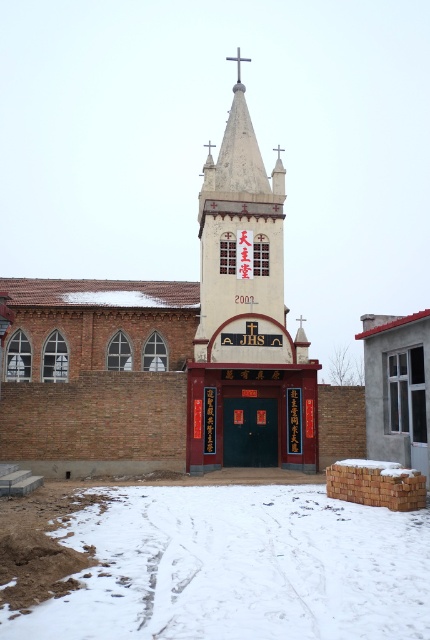
You are standing in front of the church and looking at the white powdery snow at lower center and the white plastic cross at upper center. Which object is positioned higher in the image?

The white plastic cross at upper center is positioned higher than the white powdery snow at lower center.

In the scene shown: You are standing in front of the church and notice two points marked on the building. The first point is at coordinates point (x=344, y=518) and the second is at point (x=202, y=204). Which of these two points is nearer to you?

Point (x=344, y=518) is closer to the viewer than point (x=202, y=204).

You are standing in front of the church and want to take a photo of both the white stucco church tower at center and the white plastic cross at upper center. Which object should you adjust your camera to focus on first if you want to capture both in the frame?

The white stucco church tower at center is to the left of the white plastic cross at upper center, so you should focus on the white plastic cross at upper center first to ensure both are in the frame.